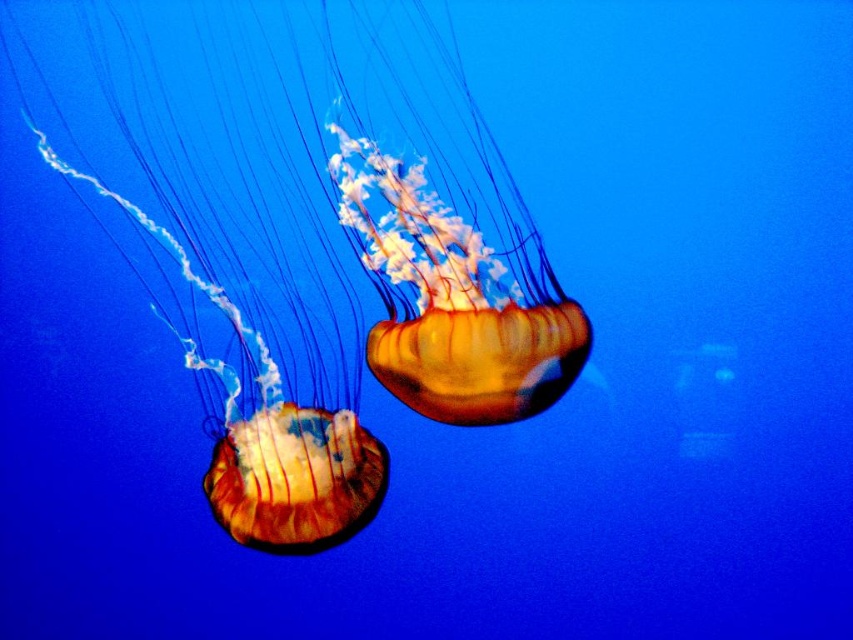
You are a marine biologist observing the jellyfish in the image. You want to take a close look at the point at coordinates point (x=126, y=140). If your underwater camera has a maximum focus range of 5 feet, will you be able to capture the point clearly?

The point at coordinates point (x=126, y=140) is 4.88 feet away from the camera, which is within the maximum focus range of 5 feet. Therefore, you can capture the point clearly.

You are a marine biologist observing the two translucent orange jellyfish in the image. Which one is closer to you, the translucent orange jellyfish at left or the translucent orange jellyfish at center?

The translucent orange jellyfish at left is closer to you because it is in front of the translucent orange jellyfish at center.